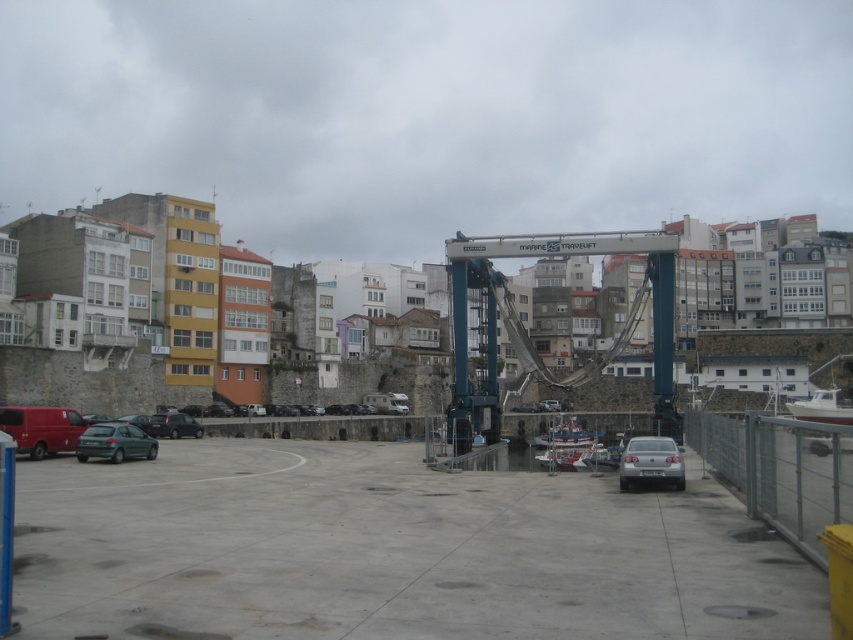
You are standing at the edge of the gray concrete parking lot at center and want to walk towards the green matte hatchback at lower left. Is the hatchback above or below your current position?

The gray concrete parking lot at center is located below the green matte hatchback at lower left, so the hatchback is above your current position.

You are a delivery driver who needs to park your truck, which is 2 meters wide, in the gray concrete parking lot at center. The green matte hatchback at lower left is already parked there. Can your truck fit in the parking lot without overlapping the hatchback?

The gray concrete parking lot at center is wider than the green matte hatchback at lower left, so the truck can fit as long as there is enough space between the hatchback and the edges of the parking lot.

You are standing at the center of the concrete area in the urban waterfront scene. You need to locate the green matte hatchback at lower left. Which direction should you look to find it?

The green matte hatchback at lower left is located at point (114, 442), which is to the lower left direction from your current position at the center of the concrete area.